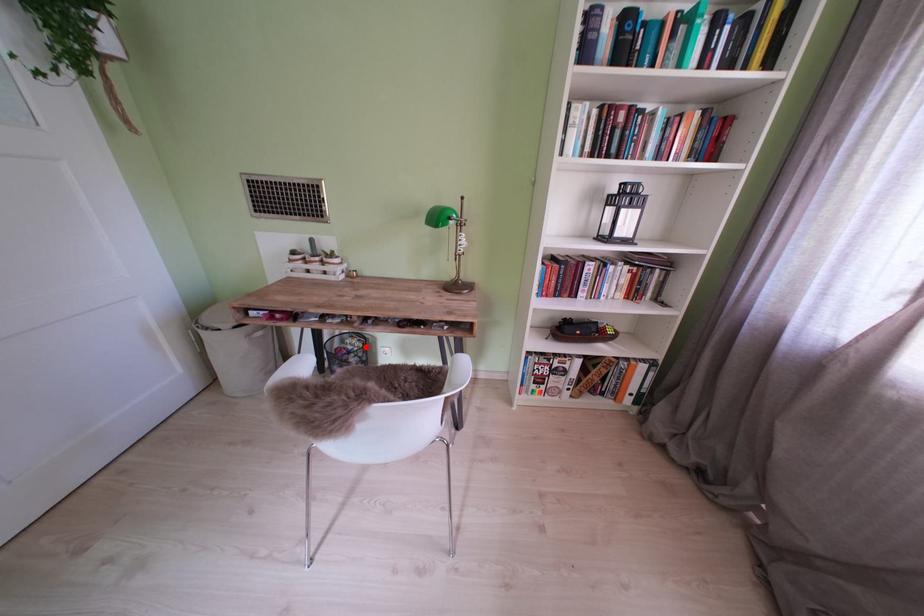
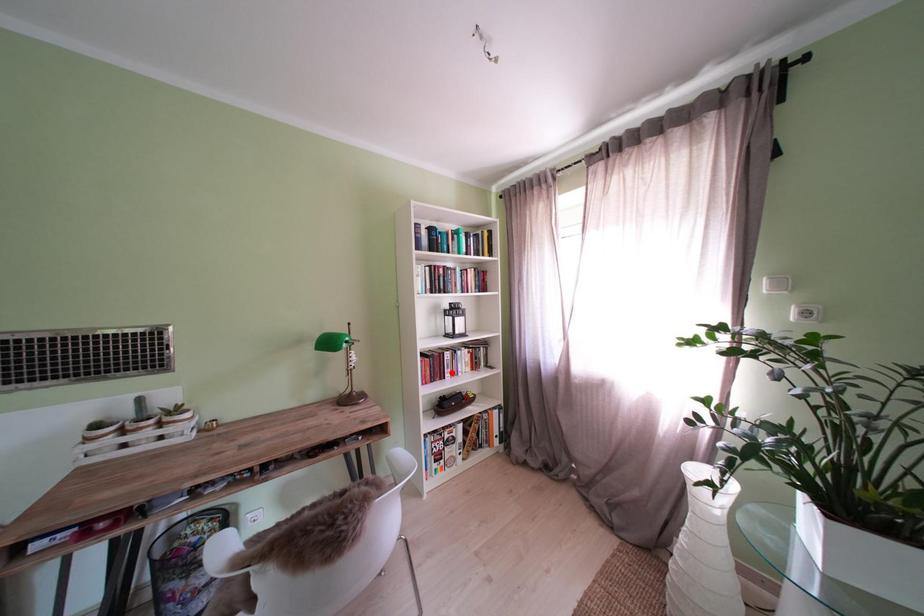
I am providing you with two images of the same scene from different viewpoints. A red point is marked on the first image and another point is marked on the second image. Is the marked point in image1 the same physical position as the marked point in image2?

No